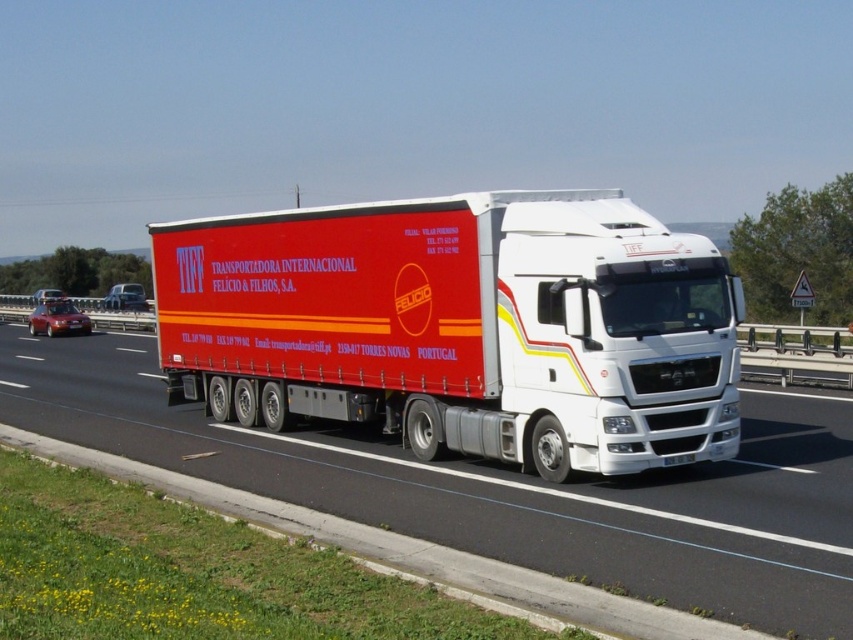
Question: Can you confirm if white matte trailer truck at center is positioned to the right of red matte truck at center?

Choices:
 (A) no
 (B) yes

Answer: (B)

Question: Can you confirm if white matte trailer truck at center is positioned to the right of red matte truck at center?

Choices:
 (A) no
 (B) yes

Answer: (B)

Question: Where is white matte trailer truck at center located in relation to red matte truck at center in the image?

Choices:
 (A) below
 (B) above

Answer: (B)